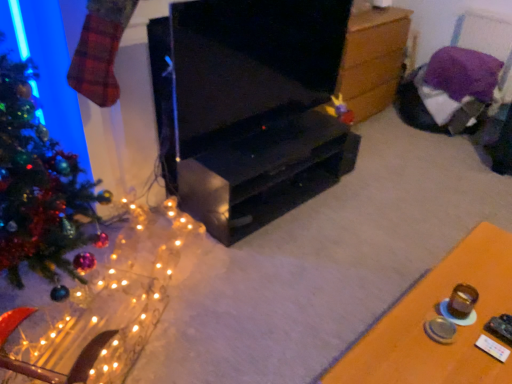
Question: From the image's perspective, is illuminated wire mesh at left below black glossy tv stand at center?

Choices:
 (A) no
 (B) yes

Answer: (B)

Question: Is illuminated wire mesh at left further to camera compared to black glossy tv stand at center?

Choices:
 (A) no
 (B) yes

Answer: (A)

Question: Can you confirm if illuminated wire mesh at left is taller than black glossy tv stand at center?

Choices:
 (A) no
 (B) yes

Answer: (A)

Question: From the image's perspective, does illuminated wire mesh at left appear higher than black glossy tv stand at center?

Choices:
 (A) no
 (B) yes

Answer: (A)

Question: From a real-world perspective, does illuminated wire mesh at left sit lower than black glossy tv stand at center?

Choices:
 (A) yes
 (B) no

Answer: (A)

Question: Looking at the image, does wooden chest at center, acting as the 1th table starting from the back, seem bigger or smaller compared to illuminated wire mesh at left?

Choices:
 (A) big
 (B) small

Answer: (A)

Question: In the image, is wooden chest at center, which ranks as the first table in top-to-bottom order, positioned in front of or behind illuminated wire mesh at left?

Choices:
 (A) front
 (B) behind

Answer: (B)

Question: From a real-world perspective, is wooden chest at center, which ranks as the first table in top-to-bottom order, physically located above or below illuminated wire mesh at left?

Choices:
 (A) below
 (B) above

Answer: (B)

Question: From the image's perspective, is wooden chest at center, which is the second table from bottom to top, above or below illuminated wire mesh at left?

Choices:
 (A) below
 (B) above

Answer: (B)

Question: Would you say wooden table at lower right, the 1th table when ordered from front to back, is inside or outside black glossy tv stand at center?

Choices:
 (A) outside
 (B) inside

Answer: (A)

Question: Considering the positions of wooden table at lower right, the 1th table when ordered from front to back, and black glossy tv stand at center in the image, is wooden table at lower right, the 1th table when ordered from front to back, wider or thinner than black glossy tv stand at center?

Choices:
 (A) wide
 (B) thin

Answer: (A)

Question: From a real-world perspective, is wooden table at lower right, the 1th table when ordered from front to back, positioned above or below black glossy tv stand at center?

Choices:
 (A) below
 (B) above

Answer: (A)

Question: Is point (410, 309) positioned closer to the camera than point (218, 77)?

Choices:
 (A) closer
 (B) farther

Answer: (A)

Question: Is shiny green christmas tree at left taller or shorter than black matte tv cabinet at center?

Choices:
 (A) short
 (B) tall

Answer: (B)

Question: Choose the correct answer: Is shiny green christmas tree at left inside black matte tv cabinet at center or outside it?

Choices:
 (A) outside
 (B) inside

Answer: (A)